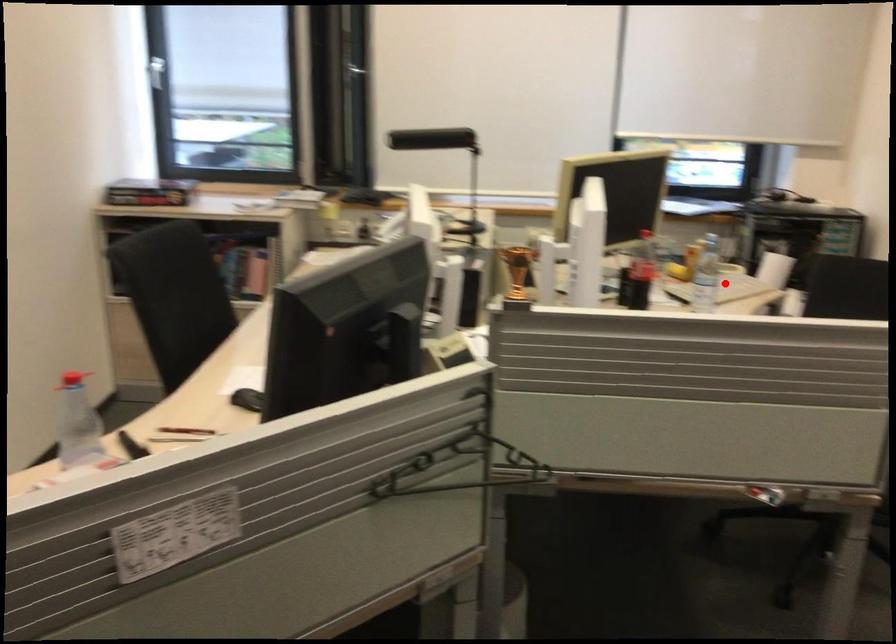
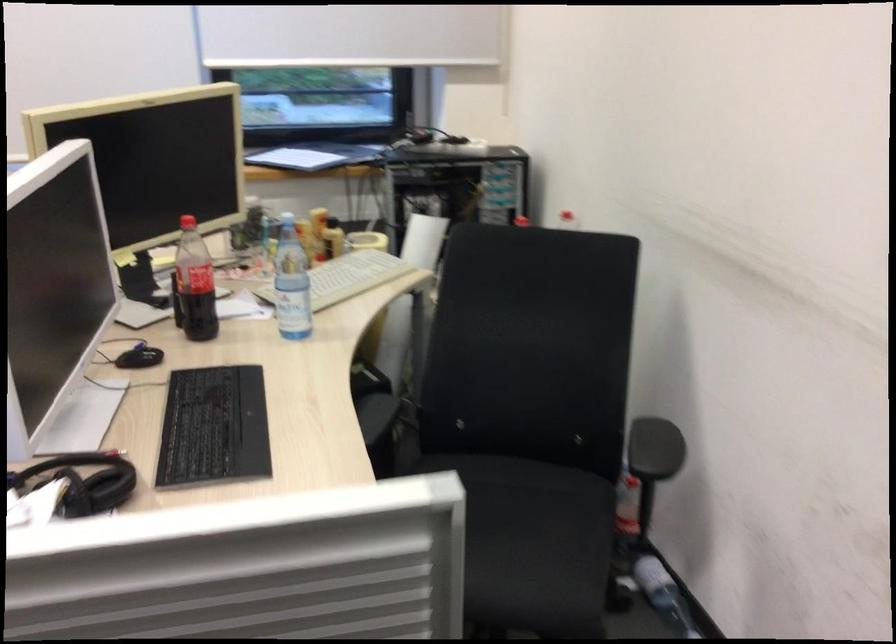
Question: I am providing you with two images of the same scene from different viewpoints. Given a red point in image1, look at the same physical point in image2. Is it:

Choices:
 (A) Closer to the viewpoint
 (B) Farther from the viewpoint

Answer: (A)